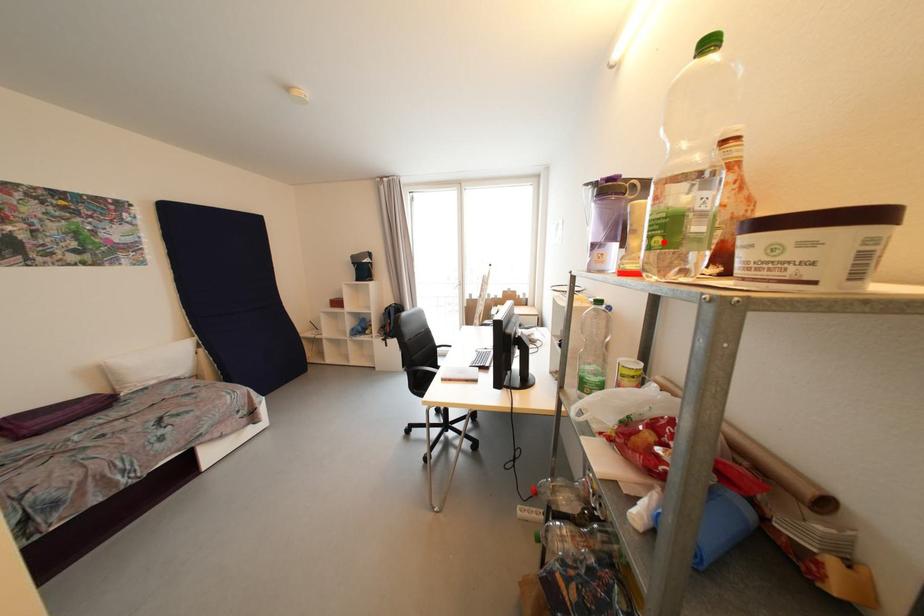
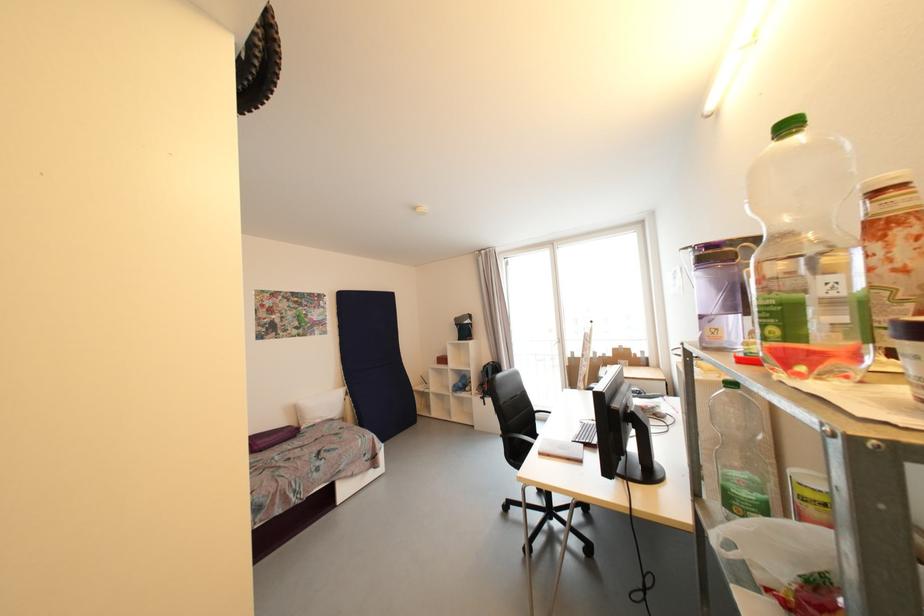
Find the pixel in the second image that matches the highlighted location in the first image.

(780, 331)